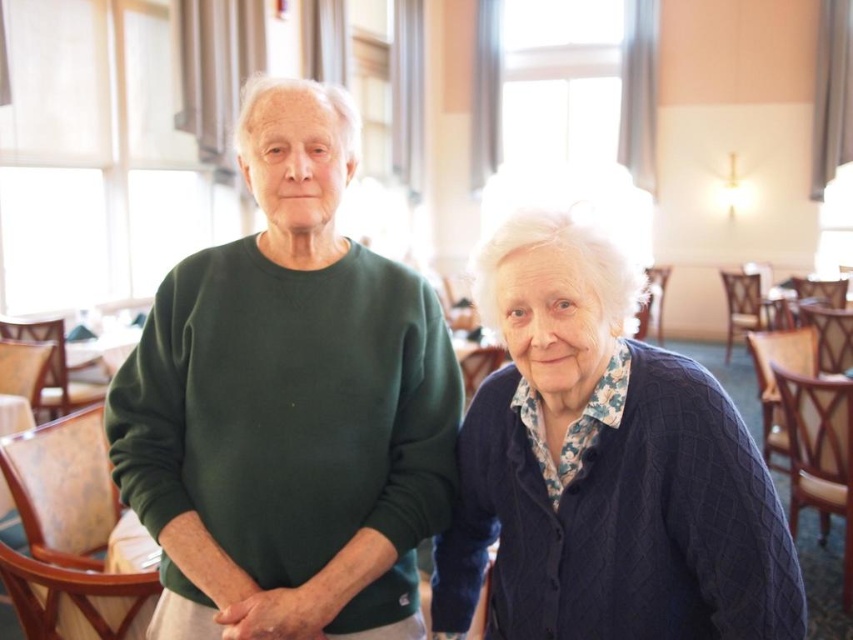
Is green cotton sweater at center smaller than knitted navy cardigan at right?

Incorrect, green cotton sweater at center is not smaller in size than knitted navy cardigan at right.

Is the position of green cotton sweater at center more distant than that of knitted navy cardigan at right?

Yes, green cotton sweater at center is further from the viewer.

Which is in front, point (241, 108) or point (634, 308)?

Point (634, 308) is more forward.

Locate an element on the screen. This screenshot has width=853, height=640. green cotton sweater at center is located at coordinates (288, 406).